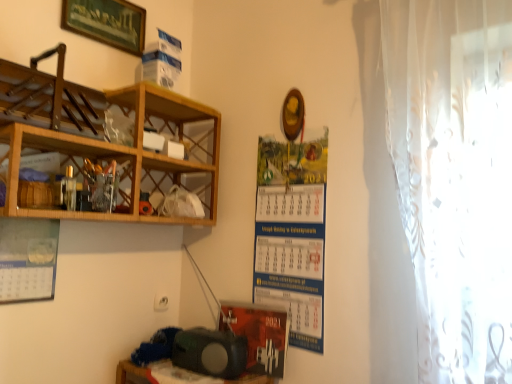
I want to click on matte paper calendar at center, so click(292, 233).

The height and width of the screenshot is (384, 512). What do you see at coordinates (292, 233) in the screenshot?
I see `matte paper calendar at center` at bounding box center [292, 233].

The image size is (512, 384). Identify the location of wooden at left, the first shelf in the top-to-bottom sequence. (49, 101).

Identify the location of matte black speaker at lower center. click(x=134, y=374).

Describe the element at coordinates (132, 154) in the screenshot. I see `wooden at left, the 2th shelf positioned from the top` at that location.

Find the location of a particular element. This screenshot has width=512, height=384. matte paper calendar at center is located at coordinates (292, 233).

Between matte black speaker at lower center and matte paper calendar at center, which one has more height?

matte paper calendar at center is taller.

Image resolution: width=512 pixels, height=384 pixels. Find the location of `speaker that is under the matte paper calendar at center (from a real-world perspective)`. speaker that is under the matte paper calendar at center (from a real-world perspective) is located at coordinates (210, 352).

Which object is thinner, matte black speaker at lower center or matte paper calendar at center?

With smaller width is matte paper calendar at center.

Is the depth of matte black speaker at lower center less than that of matte paper calendar at center?

Yes, matte black speaker at lower center is closer to the camera.

Based on the photo, could you tell me if wooden at left, the 2th shelf positioned from the top, is turned towards matte black speaker at lower center?

No.

Can you confirm if wooden at left, the 2th shelf positioned from the top, is wider than matte black speaker at lower center?

Yes.

Is wooden at left, the 1th shelf ordered from the bottom, further to the viewer compared to matte black speaker at lower center?

No, wooden at left, the 1th shelf ordered from the bottom, is closer to the camera.

From the image's perspective, is wooden at left, the 1th shelf ordered from the bottom, above or below matte black speaker at lower center?

wooden at left, the 1th shelf ordered from the bottom, is situated higher than matte black speaker at lower center in the image.

Consider the image. Does wooden at left, the 1th shelf ordered from the bottom, appear on the left side of wooden at left, the first shelf in the top-to-bottom sequence?

No, wooden at left, the 1th shelf ordered from the bottom, is not to the left of wooden at left, the first shelf in the top-to-bottom sequence.

The width and height of the screenshot is (512, 384). In order to click on shelf on the right of wooden at left, the first shelf in the top-to-bottom sequence in this screenshot , I will do `click(132, 154)`.

Which is in front, wooden at left, the 2th shelf positioned from the top, or wooden at left, the first shelf in the top-to-bottom sequence?

wooden at left, the first shelf in the top-to-bottom sequence.

Which is less distant, (x=182, y=116) or (x=42, y=91)?

The point (x=42, y=91) is closer.

Does point (16, 112) lie behind point (214, 353)?

That is False.

Considering the sizes of wooden at left, the first shelf in the top-to-bottom sequence, and matte black speaker at lower center in the image, is wooden at left, the first shelf in the top-to-bottom sequence, taller or shorter than matte black speaker at lower center?

In the image, wooden at left, the first shelf in the top-to-bottom sequence, appears to be taller than matte black speaker at lower center.

Does wooden at left, placed as the second shelf when sorted from bottom to top, touch matte black speaker at lower center?

No, wooden at left, placed as the second shelf when sorted from bottom to top, is not beside matte black speaker at lower center.

Does wooden at left, the first shelf in the top-to-bottom sequence, appear on the right side of matte black speaker at lower center?

No.

Where is `poster lying behind the matte black speaker at lower center`? The width and height of the screenshot is (512, 384). poster lying behind the matte black speaker at lower center is located at coordinates (292, 233).

In the image, is matte black speaker at lower center positioned in front of or behind matte paper calendar at center?

Visually, matte black speaker at lower center is located in front of matte paper calendar at center.

Does matte black speaker at lower center have a larger size compared to matte paper calendar at center?

Actually, matte black speaker at lower center might be smaller than matte paper calendar at center.

Would you say matte black speaker at lower center is to the left or to the right of matte paper calendar at center in the picture?

Based on their positions, matte black speaker at lower center is located to the left of matte paper calendar at center.

Is matte paper calendar at center directly adjacent to wooden at left, placed as the second shelf when sorted from bottom to top?

No, matte paper calendar at center is not next to wooden at left, placed as the second shelf when sorted from bottom to top.

Which is more to the right, matte paper calendar at center or wooden at left, placed as the second shelf when sorted from bottom to top?

matte paper calendar at center is more to the right.

Does matte paper calendar at center turn towards wooden at left, placed as the second shelf when sorted from bottom to top?

No, matte paper calendar at center is not facing towards wooden at left, placed as the second shelf when sorted from bottom to top.

From the picture: Does matte black speaker at lower center touch wooden at left, placed as the second shelf when sorted from bottom to top?

matte black speaker at lower center and wooden at left, placed as the second shelf when sorted from bottom to top, are not in contact.

Image resolution: width=512 pixels, height=384 pixels. In order to click on table that appears below the wooden at left, the first shelf in the top-to-bottom sequence (from a real-world perspective) in this screenshot , I will do `click(134, 374)`.

Is wooden at left, placed as the second shelf when sorted from bottom to top, surrounded by matte black speaker at lower center?

No, wooden at left, placed as the second shelf when sorted from bottom to top, is not surrounded by matte black speaker at lower center.

In the image, is matte black speaker at lower center on the left side or the right side of wooden at left, the first shelf in the top-to-bottom sequence?

matte black speaker at lower center is to the right of wooden at left, the first shelf in the top-to-bottom sequence.

Find the location of a particular element. The image size is (512, 384). speaker that is on the left side of matte paper calendar at center is located at coordinates (210, 352).

You are a GUI agent. You are given a task and a screenshot of the screen. Output one action in this format:
    pyautogui.click(x=<x>, y=<y>)
    Task: Click on the 1st shelf above when counting from the matte black speaker at lower center (from the image's perspective)
    
    Given the screenshot: What is the action you would take?
    pyautogui.click(x=132, y=154)

In the scene shown: Considering their positions, is wooden at left, placed as the second shelf when sorted from bottom to top, positioned further to matte black speaker at lower center than matte black speaker at lower center?

Based on the image, wooden at left, placed as the second shelf when sorted from bottom to top, appears to be further to matte black speaker at lower center.

When comparing their distances from matte paper calendar at center, does wooden framed picture at upper left or wooden at left, the 1th shelf ordered from the bottom, seem further?

wooden framed picture at upper left is further to matte paper calendar at center.

Looking at the image, which one is located further to matte black speaker at lower center, wooden at left, the 2th shelf positioned from the top, or wooden framed picture at upper left?

wooden framed picture at upper left is positioned further to the anchor matte black speaker at lower center.

Considering their positions, is matte black speaker at lower center positioned further to wooden framed picture at upper left than matte paper calendar at center?

Among the two, matte black speaker at lower center is located further to wooden framed picture at upper left.

Based on their spatial positions, is matte paper calendar at center or matte black speaker at lower center closer to matte black speaker at lower center?

Based on the image, matte black speaker at lower center appears to be nearer to matte black speaker at lower center.

Looking at the image, which one is located closer to wooden at left, the 2th shelf positioned from the top, matte paper calendar at center or wooden framed picture at upper left?

wooden framed picture at upper left.

Considering their positions, is wooden framed picture at upper left positioned closer to matte paper calendar at center than matte black speaker at lower center?

Among the two, matte black speaker at lower center is located nearer to matte paper calendar at center.

Estimate the real-world distances between objects in this image. Which object is closer to matte black speaker at lower center, matte black speaker at lower center or wooden framed picture at upper left?

Among the two, matte black speaker at lower center is located nearer to matte black speaker at lower center.

Identify the location of poster between wooden at left, the 1th shelf ordered from the bottom, and matte black speaker at lower center in the up-down direction. The image size is (512, 384). (292, 233).

Find the location of a particular element. The height and width of the screenshot is (384, 512). picture frame between wooden at left, placed as the second shelf when sorted from bottom to top, and matte paper calendar at center is located at coordinates (106, 22).

Where is `poster between wooden framed picture at upper left and matte black speaker at lower center in the vertical direction`? poster between wooden framed picture at upper left and matte black speaker at lower center in the vertical direction is located at coordinates (292, 233).

I want to click on shelf that lies between wooden framed picture at upper left and wooden at left, the 1th shelf ordered from the bottom, from top to bottom, so click(49, 101).